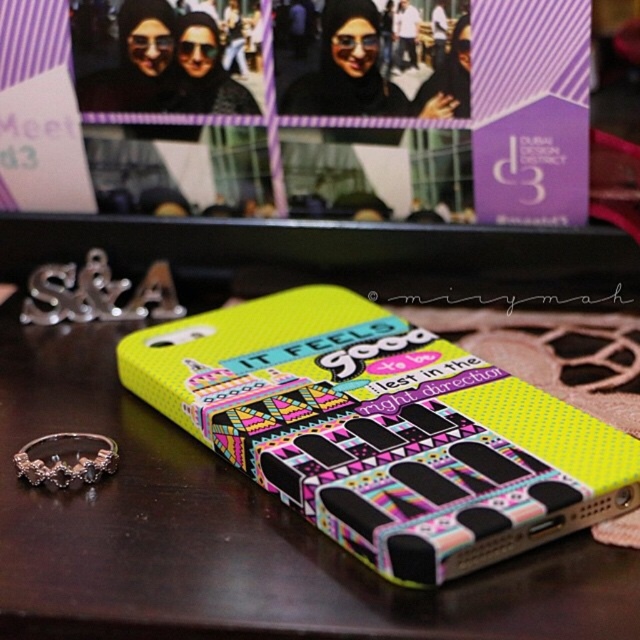
What do you see at coordinates (384, 429) in the screenshot? The width and height of the screenshot is (640, 640). I see `neon yellow textured phone case at center` at bounding box center [384, 429].

Can you confirm if neon yellow textured phone case at center is smaller than silver metallic letters at center?

No.

I want to click on neon yellow textured phone case at center, so click(384, 429).

The height and width of the screenshot is (640, 640). What are the coordinates of `neon yellow textured phone case at center` in the screenshot? It's located at (x=384, y=429).